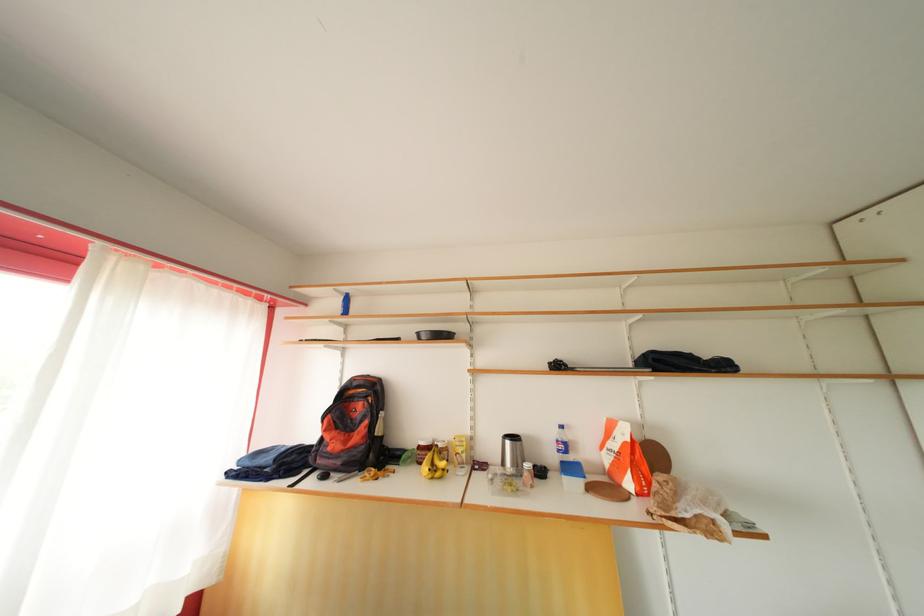
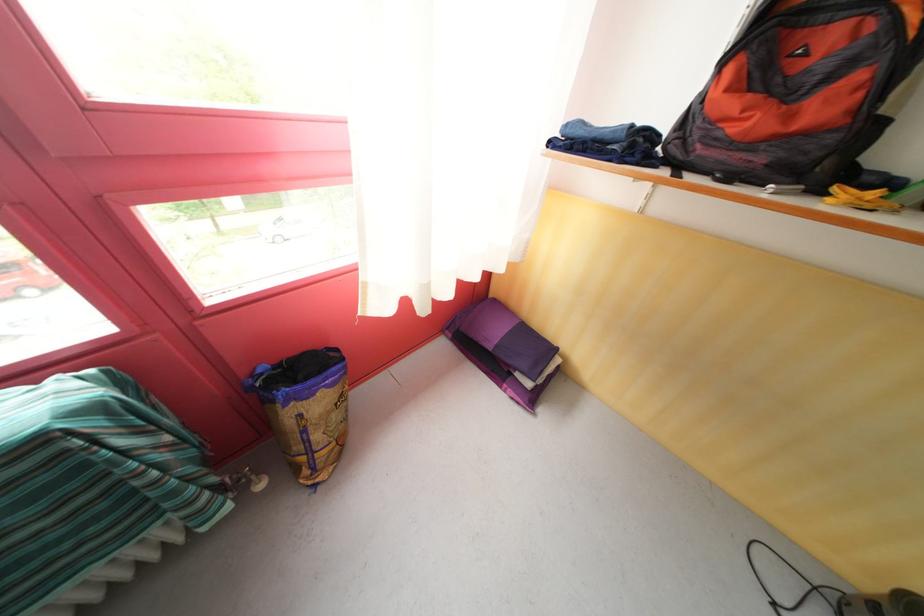
Locate, in the second image, the point that corresponds to pixel 337 461 in the first image.

(736, 151)